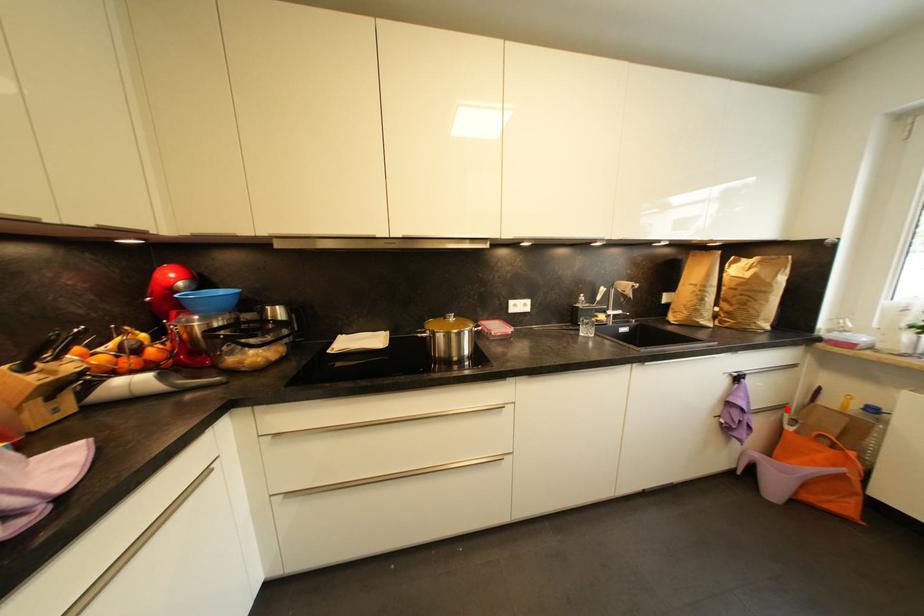
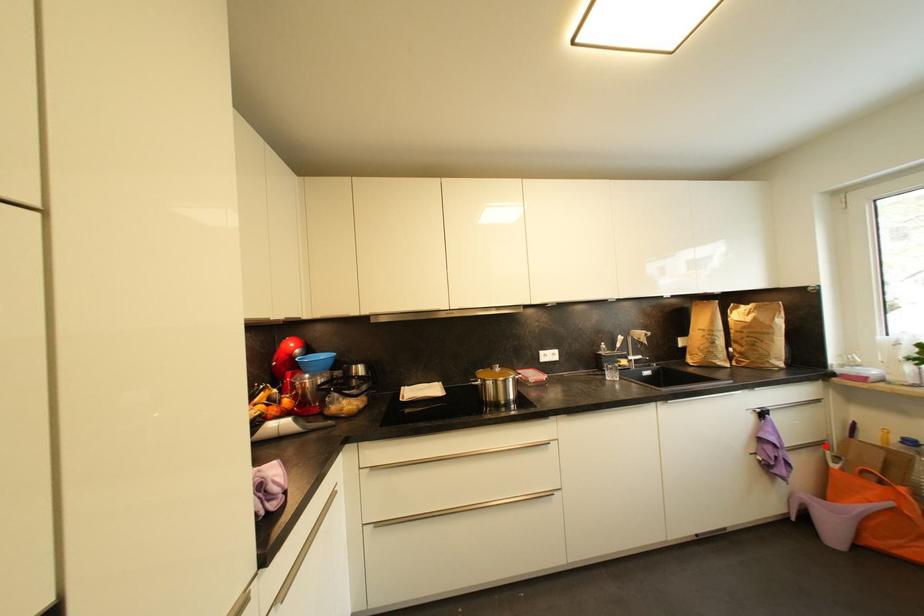
I am providing you with two images of the same scene from different viewpoints. A red point is marked on the first image and another point is marked on the second image. Is the marked point in image1 the same physical position as the marked point in image2?

Yes